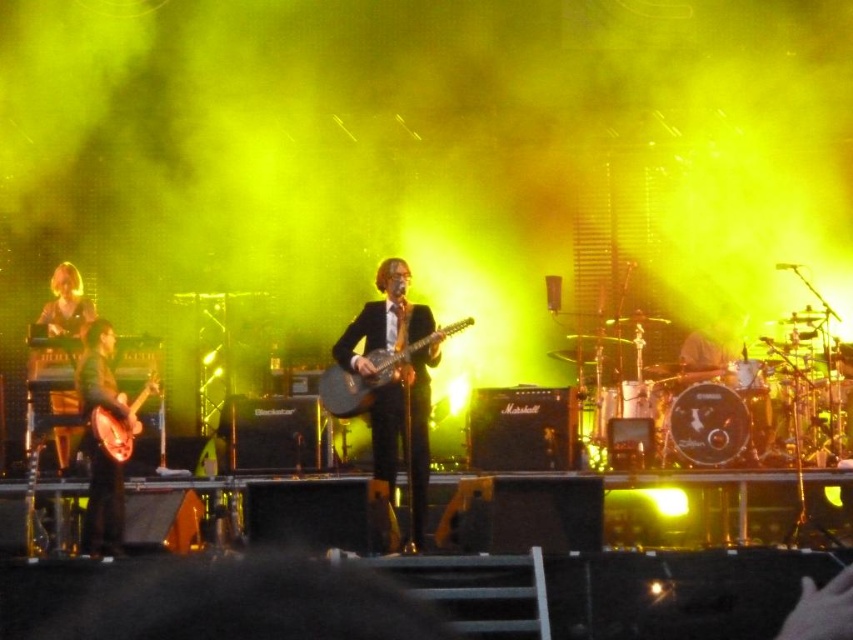
Question: Can you confirm if golden hair at left is thinner than shiny silver drum at center?

Choices:
 (A) no
 (B) yes

Answer: (A)

Question: Considering the real-world distances, which object is farthest from the shiny silver drum at center?

Choices:
 (A) matte brown guitar at left
 (B) shiny metallic guitar at center
 (C) golden hair at left
 (D) matte black guitar at center

Answer: (C)

Question: Based on their relative distances, which object is farther from the black glossy suit at center?

Choices:
 (A) matte brown guitar at left
 (B) golden hair at left

Answer: (B)

Question: Which point is closer to the camera?

Choices:
 (A) (132, 433)
 (B) (328, 406)
 (C) (78, 305)

Answer: (A)

Question: Is black glossy suit at center to the right of matte brown guitar at left from the viewer's perspective?

Choices:
 (A) no
 (B) yes

Answer: (B)

Question: Does golden hair at left have a lesser width compared to matte black guitar at center?

Choices:
 (A) yes
 (B) no

Answer: (A)